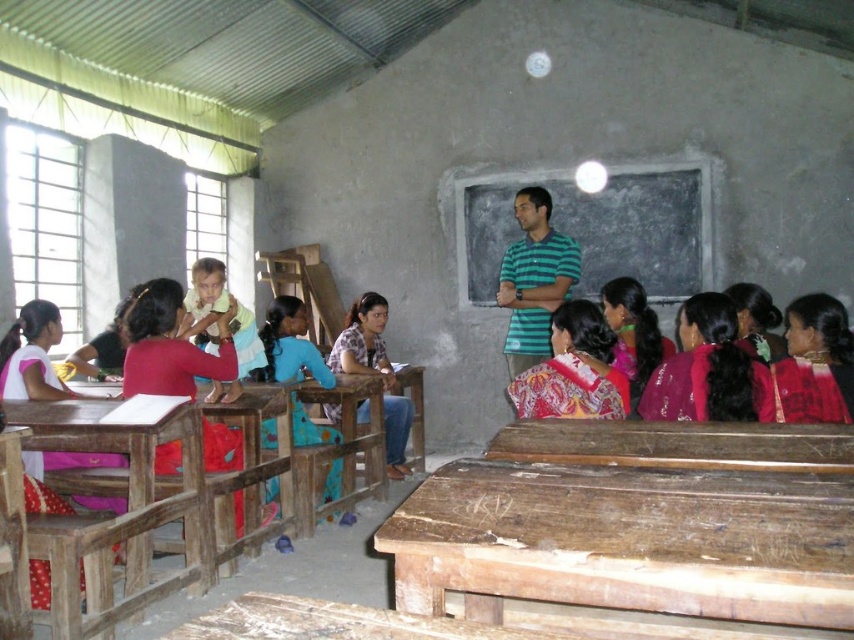
Question: Which of the following is the closest to the observer?

Choices:
 (A) (618, 188)
 (B) (217, 333)
 (C) (437, 544)
 (D) (389, 410)

Answer: (C)

Question: Observing the image, what is the correct spatial positioning of wooden desk at center in reference to patterned fabric shirt at center?

Choices:
 (A) above
 (B) below

Answer: (B)

Question: Is wooden table at lower center thinner than wooden desk at center?

Choices:
 (A) no
 (B) yes

Answer: (A)

Question: Based on their relative distances, which object is farther from the wooden table at lower center?

Choices:
 (A) black chalkboard at center
 (B) patterned fabric shirt at center
 (C) patterned fabric dress at center

Answer: (A)

Question: Which point is farther from the camera taking this photo?

Choices:
 (A) (624, 387)
 (B) (390, 428)

Answer: (B)

Question: Where is black chalkboard at center located in relation to light yellow fabric at center in the image?

Choices:
 (A) above
 (B) below

Answer: (A)